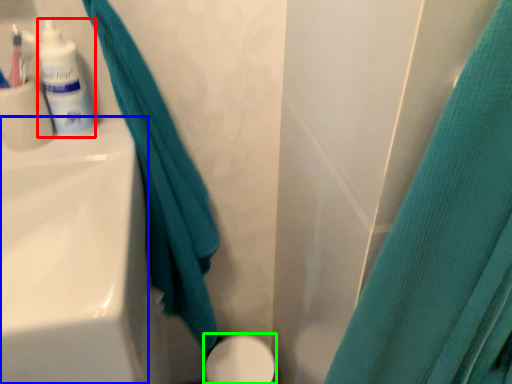
Question: Estimate the real-world distances between objects in this image. Which object is farther from toiletry (highlighted by a red box), sink (highlighted by a blue box) or porcelain (highlighted by a green box)?

Choices:
 (A) sink
 (B) porcelain

Answer: (B)